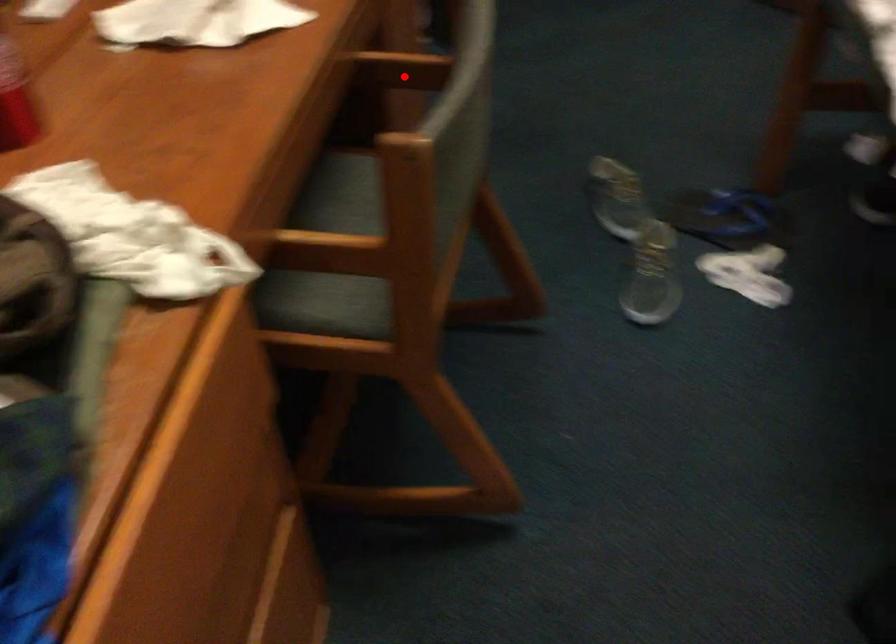
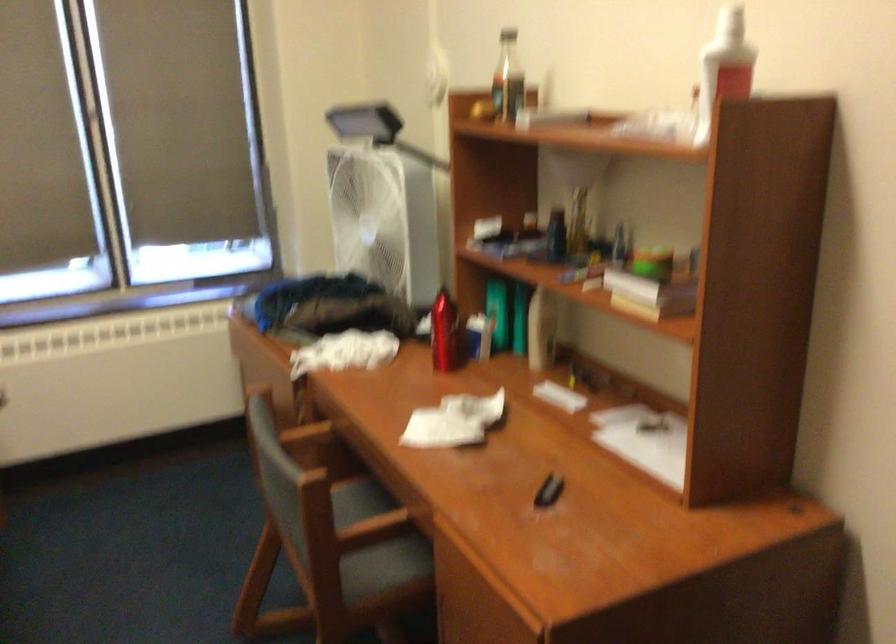
Where in the second image is the point corresponding to the highlighted location from the first image?

(375, 545)